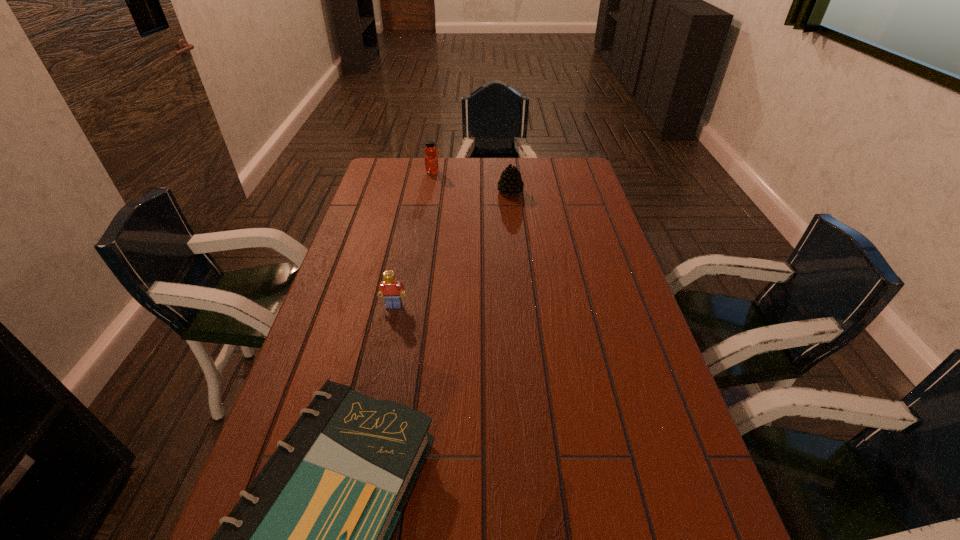
Identify the location of free area in between the honey and the Lego. (413, 239).

Identify the location of vacant space in between the third farthest object and the honey. Image resolution: width=960 pixels, height=540 pixels. (413, 239).

Find the location of a particular element. The height and width of the screenshot is (540, 960). unoccupied position between the third nearest object and the Lego is located at coordinates (452, 248).

Locate which object ranks second in proximity to the honey. Please provide its 2D coordinates. Your answer should be formatted as a tuple, i.e. [(x, y)], where the tuple contains the x and y coordinates of a point satisfying the conditions above.

[(390, 288)]

You are a GUI agent. You are given a task and a screenshot of the screen. Output one action in this format:
    pyautogui.click(x=<x>, y=<y>)
    Task: Click on the object that can be found as the third closest to the paperback book
    
    Given the screenshot: What is the action you would take?
    pyautogui.click(x=431, y=161)

What are the coordinates of `vacant space that satisfies the following two spatial constraints: 1. at the narrow end of the pinecone; 2. on the front-facing side of the second nearest object` in the screenshot? It's located at (522, 305).

What are the coordinates of `vacant area that satisfies the following two spatial constraints: 1. at the narrow end of the pinecone; 2. on the front-facing side of the second nearest object` in the screenshot? It's located at (522, 305).

At what (x,y) coordinates should I click in order to perform the action: click on free spot that satisfies the following two spatial constraints: 1. on the front label of the honey; 2. on the front-facing side of the Lego. Please return your answer as a coordinate pair (x, y). This screenshot has height=540, width=960. Looking at the image, I should click on (410, 305).